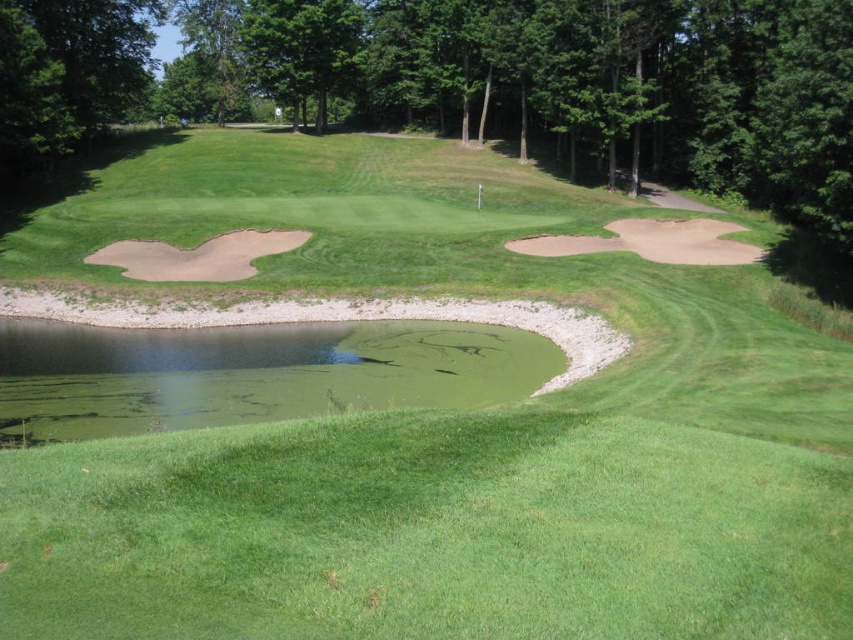
Which of these two, green algae water at center or sandy brown sand trap at left, stands taller?

Standing taller between the two is sandy brown sand trap at left.

Does green algae water at center have a lesser height compared to sandy brown sand trap at left?

Correct, green algae water at center is not as tall as sandy brown sand trap at left.

Which is behind, point (70, 324) or point (195, 259)?

The point (195, 259) is behind.

Where is `green algae water at center`? green algae water at center is located at coordinates (248, 372).